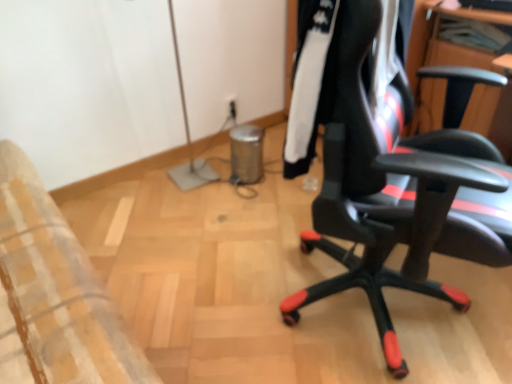
Question: From a real-world perspective, is black synthetic jacket at center right below black leather office chair at right?

Choices:
 (A) yes
 (B) no

Answer: (B)

Question: Is black synthetic jacket at center right to the right of black leather office chair at right from the viewer's perspective?

Choices:
 (A) yes
 (B) no

Answer: (B)

Question: Is black synthetic jacket at center right not within black leather office chair at right?

Choices:
 (A) yes
 (B) no

Answer: (B)

Question: From the image's perspective, is black synthetic jacket at center right below black leather office chair at right?

Choices:
 (A) no
 (B) yes

Answer: (A)

Question: Is black synthetic jacket at center right aimed at black leather office chair at right?

Choices:
 (A) yes
 (B) no

Answer: (A)

Question: Considering the relative sizes of black synthetic jacket at center right and black leather office chair at right in the image provided, is black synthetic jacket at center right wider than black leather office chair at right?

Choices:
 (A) yes
 (B) no

Answer: (B)

Question: From the image's perspective, is black leather office chair at right below black synthetic jacket at center right?

Choices:
 (A) yes
 (B) no

Answer: (A)

Question: From a real-world perspective, is black leather office chair at right physically below black synthetic jacket at center right?

Choices:
 (A) no
 (B) yes

Answer: (B)

Question: Does black leather office chair at right have a lesser width compared to black synthetic jacket at center right?

Choices:
 (A) yes
 (B) no

Answer: (B)

Question: Is black leather office chair at right positioned far away from black synthetic jacket at center right?

Choices:
 (A) no
 (B) yes

Answer: (A)

Question: Considering the relative sizes of black leather office chair at right and black synthetic jacket at center right in the image provided, is black leather office chair at right taller than black synthetic jacket at center right?

Choices:
 (A) yes
 (B) no

Answer: (A)

Question: From a real-world perspective, is black leather office chair at right over black synthetic jacket at center right?

Choices:
 (A) no
 (B) yes

Answer: (A)

Question: Considering the positions of black leather office chair at right and black synthetic jacket at center right in the image, is black leather office chair at right wider or thinner than black synthetic jacket at center right?

Choices:
 (A) thin
 (B) wide

Answer: (B)